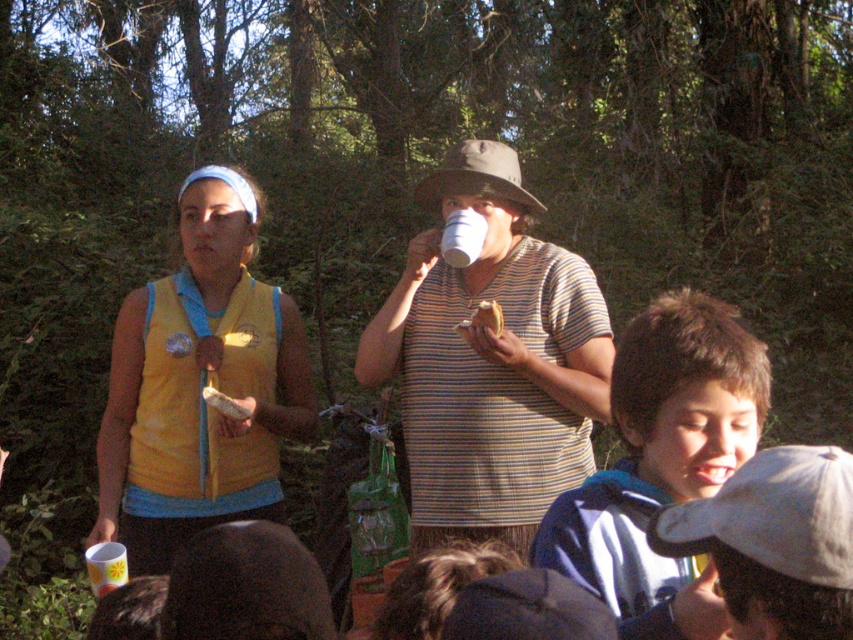
You are a photographer trying to capture a group photo of the yellow fabric vest at left and the blue fleece jacket at center. Based on their positions, which clothing item will appear larger in the photo?

The yellow fabric vest at left will appear larger in the photo because it is much taller than the blue fleece jacket at center.

You are standing in a wooded area and see two points marked in the scene. Which point is closer to you, point (225, 243) or point (664, 451)?

Point (225, 243) is closer to you than point (664, 451) because it is further to the viewer.

Looking at this image, in the described outdoor wooded scene, there is a striped cotton shirt at center and a white matte cup at center. From the observer standing in front of the scene, which object is positioned more to the right?

→ The striped cotton shirt at center is positioned to the right of the white matte cup at center.